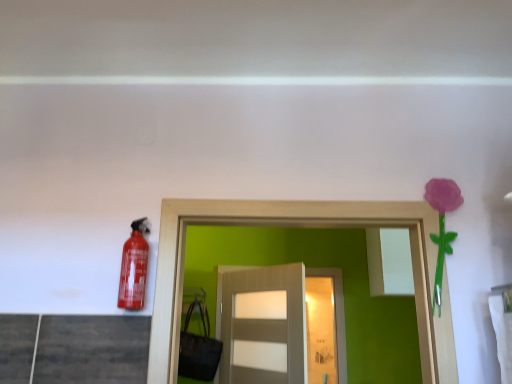
Question: Is matte red extinguisher at left taller or shorter than matte gray door at center?

Choices:
 (A) short
 (B) tall

Answer: (A)

Question: Looking at their shapes, would you say matte red extinguisher at left is wider or thinner than matte gray door at center?

Choices:
 (A) wide
 (B) thin

Answer: (B)

Question: Which object is positioned farthest from the purple matte flower at upper right?

Choices:
 (A) matte gray door at center
 (B) matte red extinguisher at left

Answer: (A)

Question: Estimate the real-world distances between objects in this image. Which object is closer to the purple matte flower at upper right?

Choices:
 (A) matte red extinguisher at left
 (B) matte gray door at center

Answer: (A)